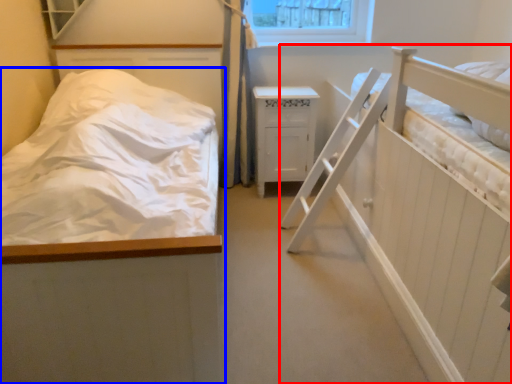
Question: Which object is closer to the camera taking this photo, hospital bed (highlighted by a red box) or bed (highlighted by a blue box)?

Choices:
 (A) hospital bed
 (B) bed

Answer: (A)